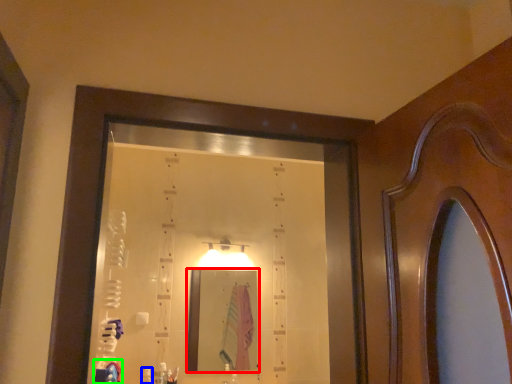
Question: Considering the real-world distances, which object is farthest from mirror (highlighted by a red box)? toiletry (highlighted by a blue box) or robe (highlighted by a green box)?

Choices:
 (A) toiletry
 (B) robe

Answer: (B)